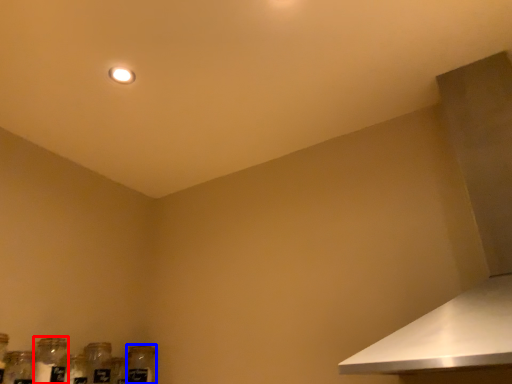
Question: Which object appears farthest to the camera in this image, bottle (highlighted by a red box) or glass bottle (highlighted by a blue box)?

Choices:
 (A) bottle
 (B) glass bottle

Answer: (B)